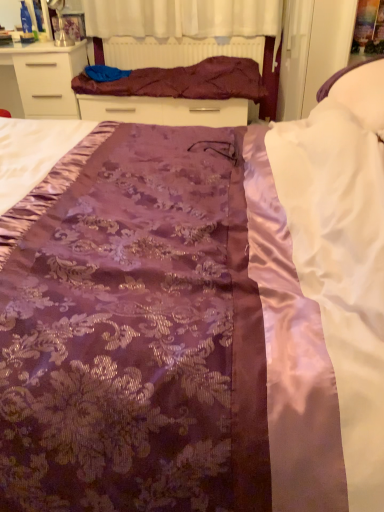
Question: Is white satin pillow at upper right positioned with its back to purple satin blanket at upper center?

Choices:
 (A) yes
 (B) no

Answer: (B)

Question: Considering the relative sizes of white satin pillow at upper right and purple satin blanket at upper center in the image provided, is white satin pillow at upper right smaller than purple satin blanket at upper center?

Choices:
 (A) no
 (B) yes

Answer: (B)

Question: From a real-world perspective, is white satin pillow at upper right physically below purple satin blanket at upper center?

Choices:
 (A) no
 (B) yes

Answer: (A)

Question: Does white satin pillow at upper right have a greater width compared to purple satin blanket at upper center?

Choices:
 (A) no
 (B) yes

Answer: (A)

Question: Is white satin pillow at upper right in contact with purple satin blanket at upper center?

Choices:
 (A) yes
 (B) no

Answer: (B)

Question: Does white satin pillow at upper right appear on the right side of purple satin blanket at upper center?

Choices:
 (A) yes
 (B) no

Answer: (A)

Question: Is purple satin bed frame at upper center closer to camera compared to white satin pillow at upper right?

Choices:
 (A) yes
 (B) no

Answer: (B)

Question: From the image's perspective, is purple satin bed frame at upper center located beneath white satin pillow at upper right?

Choices:
 (A) yes
 (B) no

Answer: (B)

Question: Is purple satin bed frame at upper center at the right side of white satin pillow at upper right?

Choices:
 (A) yes
 (B) no

Answer: (B)

Question: From a real-world perspective, is purple satin bed frame at upper center on top of white satin pillow at upper right?

Choices:
 (A) no
 (B) yes

Answer: (A)

Question: Is purple satin bed frame at upper center wider than white satin pillow at upper right?

Choices:
 (A) no
 (B) yes

Answer: (A)

Question: Is purple satin bed frame at upper center aimed at white satin pillow at upper right?

Choices:
 (A) no
 (B) yes

Answer: (B)

Question: Could purple satin blanket at upper center be considered to be inside purple satin bed frame at upper center?

Choices:
 (A) yes
 (B) no

Answer: (B)